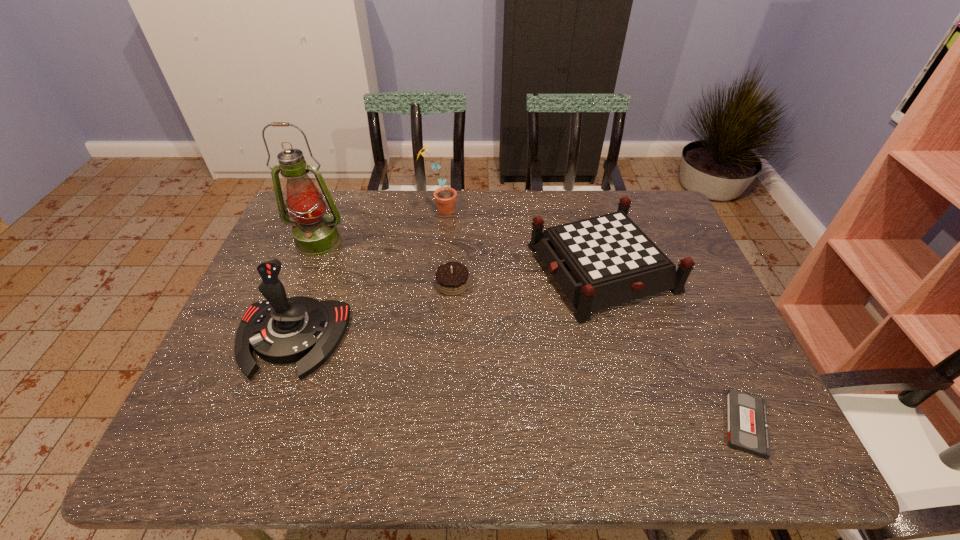
Identify the location of free space located on the back of the third shortest object. (586, 208).

Find the location of a particular element. The height and width of the screenshot is (540, 960). vacant region located 0.310m on the front of the second shortest object is located at coordinates (445, 400).

Locate an element on the screen. Image resolution: width=960 pixels, height=540 pixels. vacant space located 0.160m on the left of the nearest object is located at coordinates (643, 424).

Where is `oil lamp at the far edge`? The height and width of the screenshot is (540, 960). oil lamp at the far edge is located at coordinates (315, 234).

I want to click on sunflower that is at the far edge, so click(445, 197).

The width and height of the screenshot is (960, 540). I want to click on checkerboard present at the far edge, so [x=600, y=262].

This screenshot has width=960, height=540. I want to click on object located in the near edge section of the desktop, so click(747, 424).

This screenshot has height=540, width=960. In order to click on oil lamp present at the left edge in this screenshot , I will do `click(315, 234)`.

This screenshot has height=540, width=960. I want to click on joystick that is at the left edge, so click(x=280, y=330).

The width and height of the screenshot is (960, 540). Identify the location of checkerboard that is at the right edge. (600, 262).